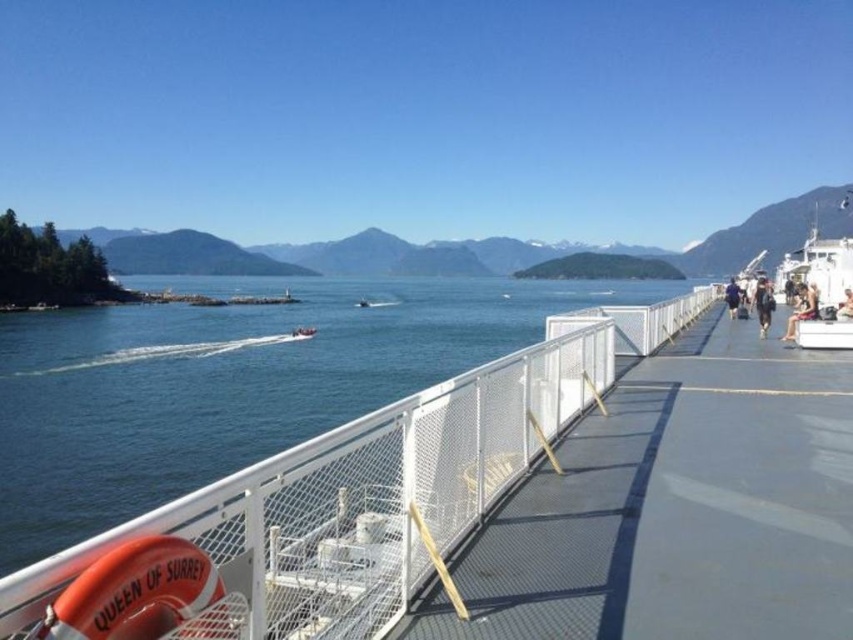
Does light brown leather jacket at right have a greater width compared to black fabric pants at right?

Indeed, light brown leather jacket at right has a greater width compared to black fabric pants at right.

Which is in front, point (807, 316) or point (764, 328)?

Point (807, 316) is more forward.

Image resolution: width=853 pixels, height=640 pixels. Identify the location of light brown leather jacket at right. (801, 308).

From the picture: Does white mesh fence at center have a larger size compared to white plastic boat at center?

Yes, white mesh fence at center is bigger than white plastic boat at center.

Is point (715, 625) farther from camera compared to point (305, 333)?

No, it is not.

Does point (805, 637) come behind point (291, 333)?

No, it is in front of (291, 333).

This screenshot has width=853, height=640. I want to click on white mesh fence at center, so click(x=677, y=508).

Is black fabric pants at right positioned at the back of white plastic boat at center?

No, black fabric pants at right is in front of white plastic boat at center.

Is point (755, 301) farther from camera compared to point (291, 333)?

That is False.

Where is `black fabric pants at right`? This screenshot has width=853, height=640. black fabric pants at right is located at coordinates (763, 305).